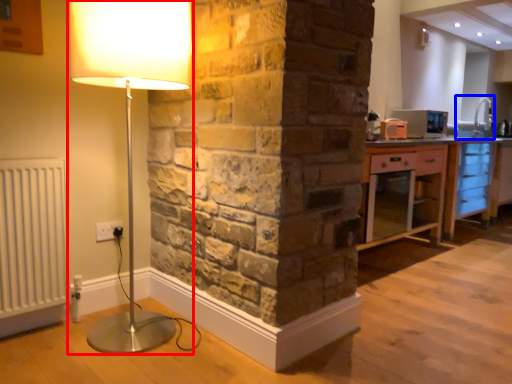
Question: Among these objects, which one is farthest to the camera, lamp (highlighted by a red box) or sink (highlighted by a blue box)?

Choices:
 (A) lamp
 (B) sink

Answer: (B)